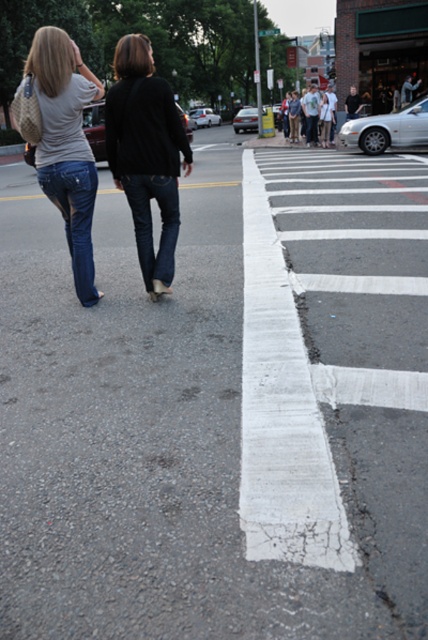
Question: Which of the following is the farthest from the observer?

Choices:
 (A) (148, 262)
 (B) (62, 177)

Answer: (A)

Question: Is black matte sweater at center above denim jeans at left?

Choices:
 (A) no
 (B) yes

Answer: (A)

Question: Which of the following is the farthest from the observer?

Choices:
 (A) black matte sweater at center
 (B) denim jeans at lower left
 (C) denim at center

Answer: (B)

Question: Which object is the closest to the black matte sweater at center?

Choices:
 (A) denim at center
 (B) denim jeans at left

Answer: (A)

Question: Does black matte sweater at center have a greater width compared to denim jeans at lower left?

Choices:
 (A) no
 (B) yes

Answer: (B)

Question: Can you confirm if denim jeans at left is thinner than denim at center?

Choices:
 (A) yes
 (B) no

Answer: (B)